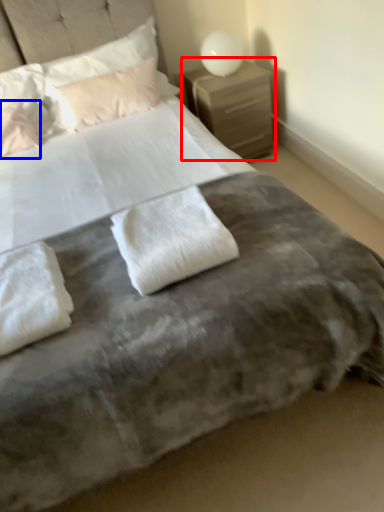
Question: Among these objects, which one is nearest to the camera, nightstand (highlighted by a red box) or pillow (highlighted by a blue box)?

Choices:
 (A) nightstand
 (B) pillow

Answer: (B)